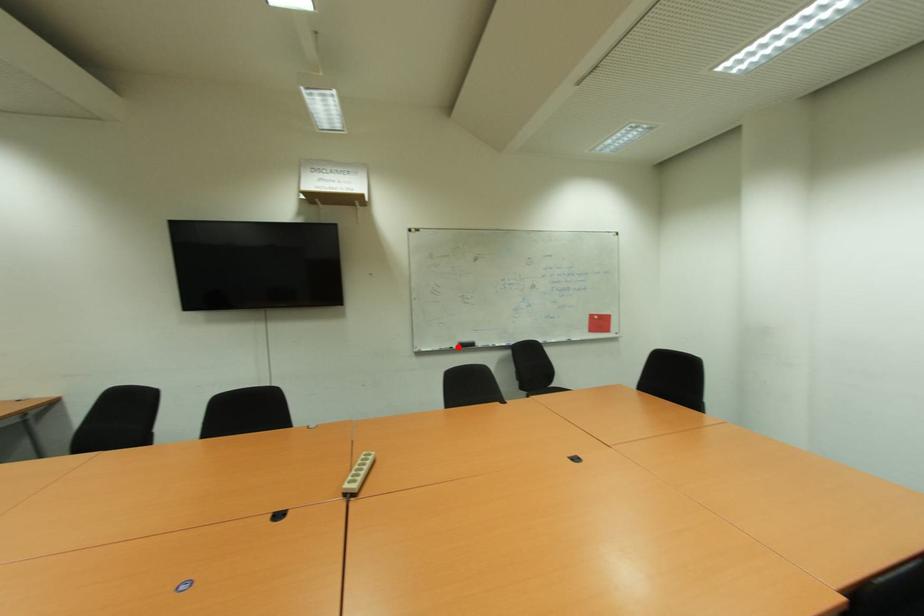
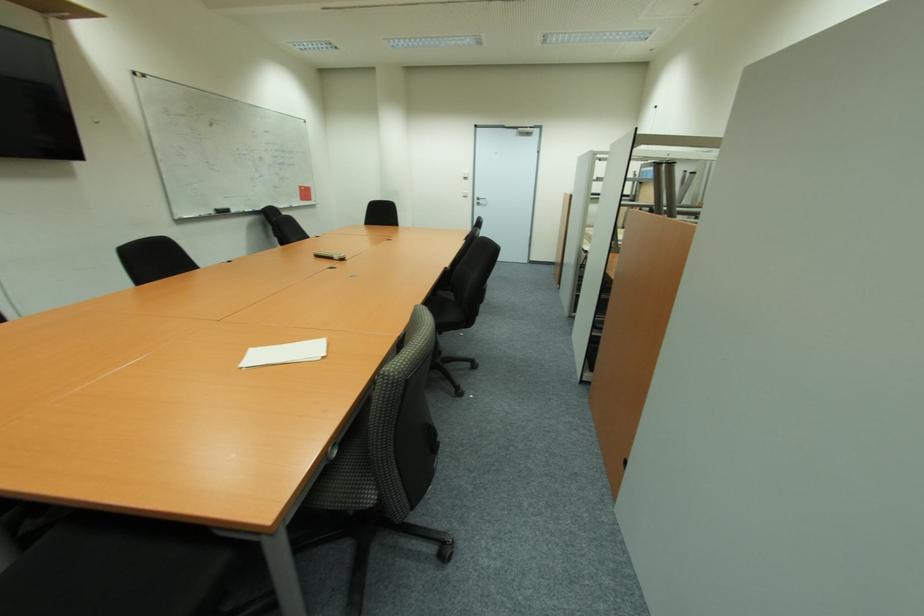
Where in the second image is the point corresponding to the highlighted location from the first image?

(215, 214)